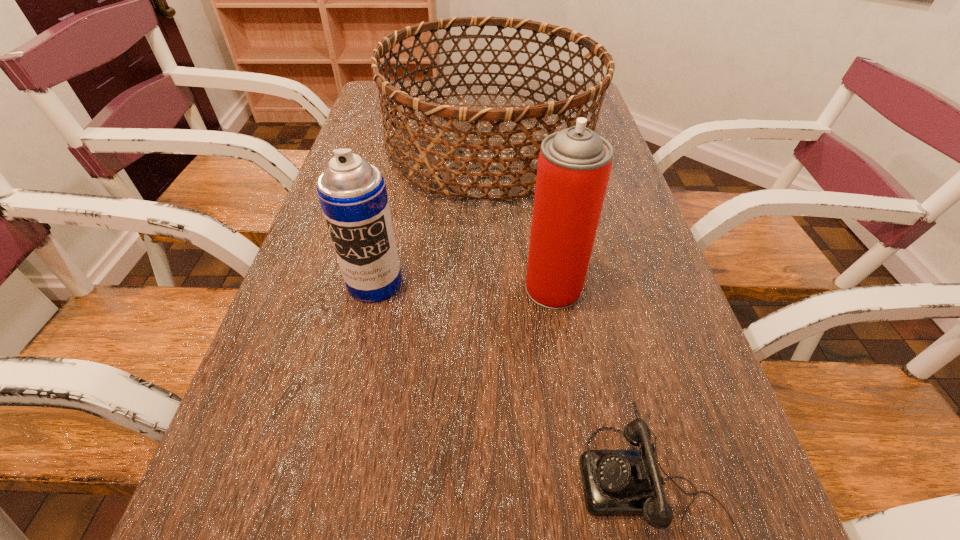
Where is `the tallest object`? the tallest object is located at coordinates (574, 165).

Image resolution: width=960 pixels, height=540 pixels. What are the coordinates of `the right aerosol can` in the screenshot? It's located at click(574, 165).

Locate an element on the screen. the left aerosol can is located at coordinates (353, 196).

Locate an element on the screen. basket is located at coordinates (429, 158).

Locate an element on the screen. free region located 0.070m on the right of the taller aerosol can is located at coordinates [617, 288].

Where is `vacant region located on the label side of the shorter aerosol can`? vacant region located on the label side of the shorter aerosol can is located at coordinates (325, 498).

Identify the location of vacant space situated on the front of the farthest object. (494, 279).

You are a GUI agent. You are given a task and a screenshot of the screen. Output one action in this format:
    pyautogui.click(x=<x>, y=<y>)
    Task: Click on the object at the far edge
    
    Given the screenshot: What is the action you would take?
    pyautogui.click(x=429, y=158)

Find the location of `aerosol can that is at the left edge`. aerosol can that is at the left edge is located at coordinates (353, 196).

You are a GUI agent. You are given a task and a screenshot of the screen. Output one action in this format:
    pyautogui.click(x=<x>, y=<y>)
    Task: Click on the basket that is at the left edge
    This screenshot has width=960, height=540.
    Given the screenshot: What is the action you would take?
    pyautogui.click(x=429, y=158)